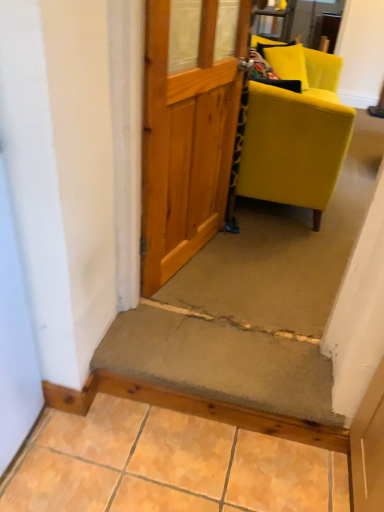
Question: Is concrete textured step at center, which is the first stairwell in bottom-to-top order, situated inside carpeted stairwell at center, marked as the first stairwell in a back-to-front arrangement, or outside?

Choices:
 (A) outside
 (B) inside

Answer: (A)

Question: Is concrete textured step at center, which is the first stairwell in bottom-to-top order, taller or shorter than carpeted stairwell at center, positioned as the second stairwell in front-to-back order?

Choices:
 (A) tall
 (B) short

Answer: (A)

Question: Considering the real-world distances, which object is closest to the concrete textured step at center, the second stairwell from the back?

Choices:
 (A) carpeted stairwell at center, positioned as the second stairwell in front-to-back order
 (B) smooth concrete step at lower center
 (C) matte yellow fabric chair at right

Answer: (A)

Question: Estimate the real-world distances between objects in this image. Which object is farther from the concrete textured step at center, the first stairwell positioned from the front?

Choices:
 (A) carpeted stairwell at center, positioned as the second stairwell in front-to-back order
 (B) matte yellow fabric chair at right
 (C) smooth concrete step at lower center

Answer: (B)